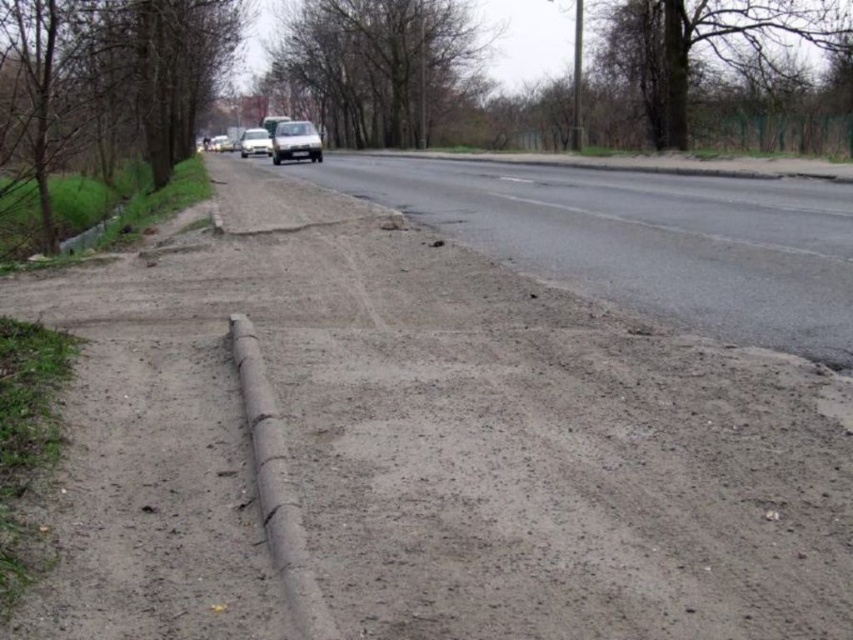
Question: Which point appears closest to the camera in this image?

Choices:
 (A) (223, 138)
 (B) (305, 131)
 (C) (250, 136)

Answer: (B)

Question: Which of the following is the farthest from the observer?

Choices:
 (A) satin silver sedan at center
 (B) matte black car at center
 (C) white matte car at center

Answer: (B)

Question: Can you confirm if satin silver sedan at center is positioned to the left of matte black car at center?

Choices:
 (A) no
 (B) yes

Answer: (A)

Question: Which object is farther from the camera taking this photo?

Choices:
 (A) matte black car at center
 (B) satin silver sedan at center
 (C) white matte car at center

Answer: (A)

Question: Is white matte car at center thinner than matte black car at center?

Choices:
 (A) no
 (B) yes

Answer: (A)

Question: Does satin silver sedan at center have a smaller size compared to matte black car at center?

Choices:
 (A) no
 (B) yes

Answer: (A)